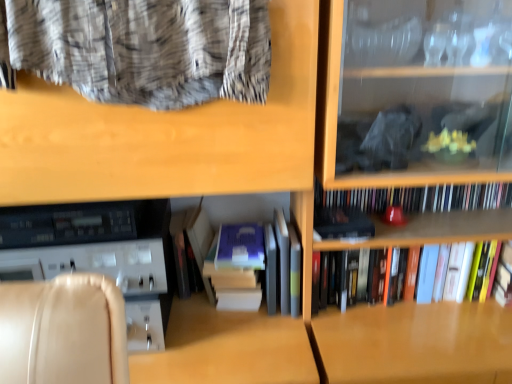
Locate an element on the screen. This screenshot has width=512, height=384. empty space that is ontop of blue matte paperback book at center, the 2th paperback book when ordered from right to left (from a real-world perspective) is located at coordinates (242, 236).